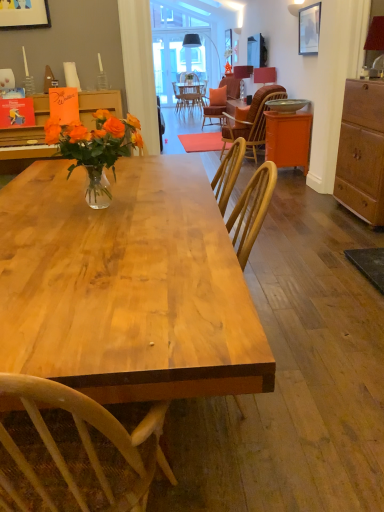
Question: Is wooden cabinet at right taller than matte red lampshade at upper right, the first lamp positioned from the right?

Choices:
 (A) no
 (B) yes

Answer: (B)

Question: Is matte red lampshade at upper right, the first lamp positioned from the front, located within wooden cabinet at right?

Choices:
 (A) yes
 (B) no

Answer: (B)

Question: Is wooden cabinet at right in front of matte red lampshade at upper right, the 3th lamp positioned from the back?

Choices:
 (A) no
 (B) yes

Answer: (B)

Question: Is wooden cabinet at right shorter than matte red lampshade at upper right, the first lamp positioned from the front?

Choices:
 (A) no
 (B) yes

Answer: (A)

Question: Can you confirm if wooden cabinet at right is bigger than matte red lampshade at upper right, the first lamp positioned from the right?

Choices:
 (A) yes
 (B) no

Answer: (A)

Question: Considering the relative sizes of wooden cabinet at right and matte red lampshade at upper right, the first lamp positioned from the right, in the image provided, is wooden cabinet at right smaller than matte red lampshade at upper right, the first lamp positioned from the right,?

Choices:
 (A) no
 (B) yes

Answer: (A)

Question: Is matte red lampshade at upper right, which is the 2th lamp from top to bottom, in front of orange matte cabinet at right?

Choices:
 (A) yes
 (B) no

Answer: (B)

Question: Considering the relative sizes of matte red lampshade at upper right, which is the 2th lamp from back to front, and orange matte cabinet at right in the image provided, is matte red lampshade at upper right, which is the 2th lamp from back to front, thinner than orange matte cabinet at right?

Choices:
 (A) no
 (B) yes

Answer: (B)

Question: Is matte red lampshade at upper right, placed as the 2th lamp when sorted from left to right, bigger than orange matte cabinet at right?

Choices:
 (A) yes
 (B) no

Answer: (B)

Question: Is matte red lampshade at upper right, which is the 2th lamp from back to front, not near orange matte cabinet at right?

Choices:
 (A) yes
 (B) no

Answer: (A)

Question: Considering the relative sizes of matte red lampshade at upper right, which is the 2th lamp from top to bottom, and orange matte cabinet at right in the image provided, is matte red lampshade at upper right, which is the 2th lamp from top to bottom, taller than orange matte cabinet at right?

Choices:
 (A) yes
 (B) no

Answer: (B)

Question: Does matte red lampshade at upper right, which is counted as the 2th lamp, starting from the bottom, have a lesser height compared to orange matte cabinet at right?

Choices:
 (A) no
 (B) yes

Answer: (B)

Question: Could you tell me if matte red lampshade at upper right, which is the 2th lamp from top to bottom, is turned towards matte red lampshade at upper right, the first lamp positioned from the front?

Choices:
 (A) no
 (B) yes

Answer: (A)